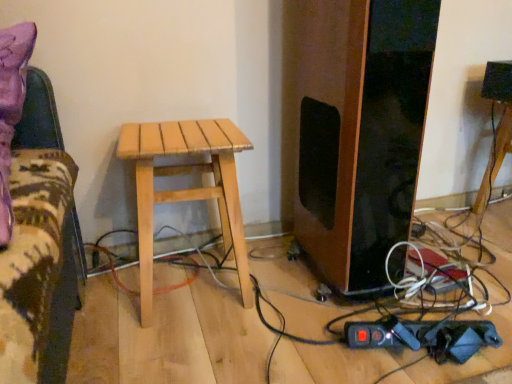
Measure the distance between point (181, 128) and camera.

A distance of 1.08 meters exists between point (181, 128) and camera.

Describe the element at coordinates (187, 189) in the screenshot. I see `natural wood stool at center` at that location.

In order to click on natural wood stool at center in this screenshot , I will do `click(187, 189)`.

Describe the element at coordinates (495, 158) in the screenshot. I see `wooden stool at center` at that location.

Measure the distance between point (x=489, y=176) and camera.

The distance of point (x=489, y=176) from camera is 1.61 meters.

Locate an element on the screen. The height and width of the screenshot is (384, 512). wooden stool at center is located at coordinates (495, 158).

Where is `natural wood stool at center`? The width and height of the screenshot is (512, 384). natural wood stool at center is located at coordinates (187, 189).

Can you confirm if wooden stool at center is positioned to the left of natural wood stool at center?

Incorrect, wooden stool at center is not on the left side of natural wood stool at center.

Relative to natural wood stool at center, is wooden stool at center in front or behind?

Visually, wooden stool at center is located behind natural wood stool at center.

Is point (483, 178) positioned before point (223, 186)?

No, it is not.

From the picture: From the image's perspective, is wooden stool at center above or below natural wood stool at center?

Based on their image positions, wooden stool at center is located above natural wood stool at center.

From a real-world perspective, which object stands above the other?

In real-world perspective, natural wood stool at center is above.

Which object is thinner, wooden stool at center or natural wood stool at center?

wooden stool at center is thinner.

Who is shorter, wooden stool at center or natural wood stool at center?

wooden stool at center is shorter.

Which of these two, wooden stool at center or natural wood stool at center, is bigger?

Bigger between the two is natural wood stool at center.

Is wooden stool at center completely or partially outside of natural wood stool at center?

wooden stool at center is positioned outside natural wood stool at center.

From the picture: Are wooden stool at center and natural wood stool at center far apart?

Absolutely, wooden stool at center is distant from natural wood stool at center.

Could you tell me if wooden stool at center is facing natural wood stool at center?

No.

What's the angular difference between wooden stool at center and natural wood stool at center's facing directions?

The angle between the facing direction of wooden stool at center and the facing direction of natural wood stool at center is 5.84 degrees.

In order to click on stool in front of the wooden stool at center in this screenshot , I will do `click(187, 189)`.

Considering the relative positions of natural wood stool at center and wooden stool at center in the image provided, is natural wood stool at center to the right of wooden stool at center from the viewer's perspective?

In fact, natural wood stool at center is to the left of wooden stool at center.

Is natural wood stool at center in front of or behind wooden stool at center in the image?

Visually, natural wood stool at center is located in front of wooden stool at center.

Is point (230, 142) behind point (500, 157)?

No, (230, 142) is in front of (500, 157).

From the image's perspective, is natural wood stool at center positioned above or below wooden stool at center?

From the image's perspective, natural wood stool at center appears below wooden stool at center.

From a real-world perspective, is natural wood stool at center located higher than wooden stool at center?

Yes, from a real-world perspective, natural wood stool at center is above wooden stool at center.

Is natural wood stool at center wider than wooden stool at center?

Indeed, natural wood stool at center has a greater width compared to wooden stool at center.

Considering the sizes of natural wood stool at center and wooden stool at center in the image, is natural wood stool at center taller or shorter than wooden stool at center?

Considering their sizes, natural wood stool at center has more height than wooden stool at center.

In the scene shown: Who is bigger, natural wood stool at center or wooden stool at center?

With larger size is natural wood stool at center.

Is natural wood stool at center not within wooden stool at center?

natural wood stool at center is positioned outside wooden stool at center.

Is the surface of natural wood stool at center in direct contact with wooden stool at center?

natural wood stool at center is not next to wooden stool at center, and they're not touching.

Is natural wood stool at center positioned with its back to wooden stool at center?

No, wooden stool at center is not at the back of natural wood stool at center.

Find the location of a particular element. stool in front of the wooden stool at center is located at coordinates (187, 189).

Locate an element on the screen. table below the natural wood stool at center (from a real-world perspective) is located at coordinates (495, 158).

In order to click on stool on the left side of wooden stool at center in this screenshot , I will do `click(187, 189)`.